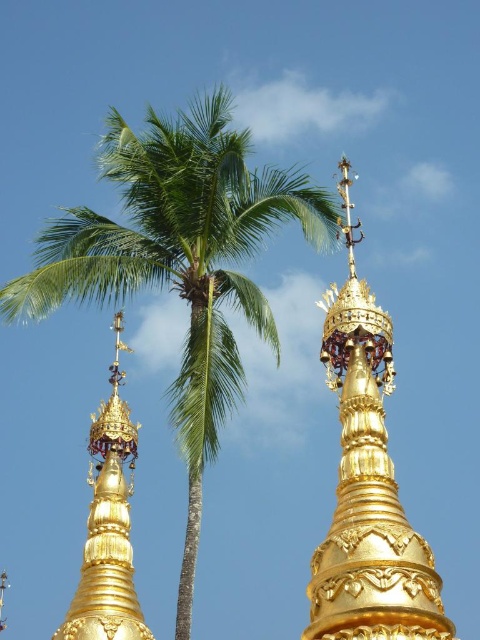
Can you confirm if green leafy palm tree at left is positioned to the left of gold polished stupa at upper center?

Correct, you'll find green leafy palm tree at left to the left of gold polished stupa at upper center.

From the picture: Which is below, green leafy palm tree at left or gold polished stupa at upper center?

Positioned lower is gold polished stupa at upper center.

Where is `green leafy palm tree at left`? green leafy palm tree at left is located at coordinates (180, 262).

Is gold polished stupa at upper center shorter than gold/gilded stupa at center?

Yes, gold polished stupa at upper center is shorter than gold/gilded stupa at center.

At what (x,y) coordinates should I click in order to perform the action: click on gold polished stupa at upper center. Please return your answer as a coordinate pair (x, y). Image resolution: width=480 pixels, height=640 pixels. Looking at the image, I should click on (367, 484).

Which is more to the left, green leafy palm tree at left or gold/gilded stupa at center?

Positioned to the left is gold/gilded stupa at center.

From the picture: Can you confirm if green leafy palm tree at left is positioned above gold/gilded stupa at center?

Indeed, green leafy palm tree at left is positioned over gold/gilded stupa at center.

Which is behind, point (95, 241) or point (99, 552)?

The point (99, 552) is behind.

The width and height of the screenshot is (480, 640). What are the coordinates of `green leafy palm tree at left` in the screenshot? It's located at (180, 262).